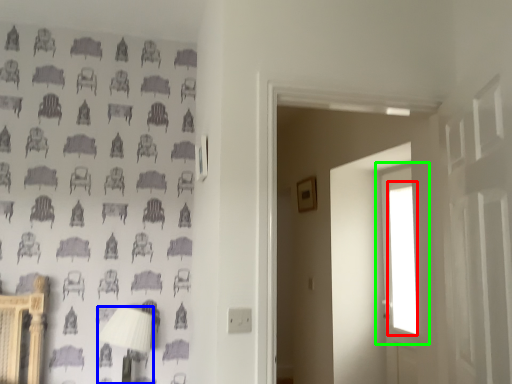
Question: Considering the real-world distances, which object is closest to window (highlighted by a red box)? table lamp (highlighted by a blue box) or window (highlighted by a green box).

Choices:
 (A) table lamp
 (B) window

Answer: (B)